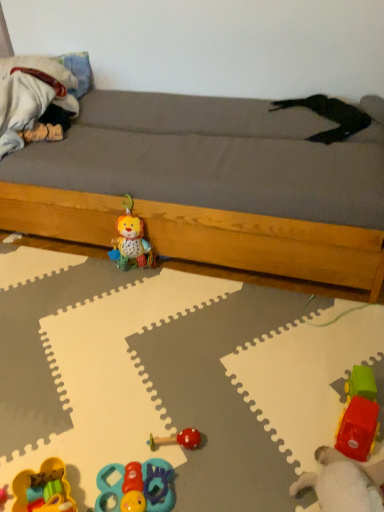
Question: Is rubberized plastic car at lower right, the second toy from the right, at the right side of plush fabric lion at center, arranged as the 5th toy when viewed from the right?

Choices:
 (A) no
 (B) yes

Answer: (B)

Question: Does rubberized plastic car at lower right, the second toy from the right, contain plush fabric lion at center, arranged as the 5th toy when viewed from the right?

Choices:
 (A) no
 (B) yes

Answer: (A)

Question: Is rubberized plastic car at lower right, the fifth toy when ordered from left to right, behind plush fabric lion at center, the 2th toy when ordered from left to right?

Choices:
 (A) no
 (B) yes

Answer: (A)

Question: Is rubberized plastic car at lower right, the fifth toy when ordered from left to right, placed right next to plush fabric lion at center, arranged as the 5th toy when viewed from the right?

Choices:
 (A) no
 (B) yes

Answer: (A)

Question: Does rubberized plastic car at lower right, the fifth toy when ordered from left to right, have a greater height compared to plush fabric lion at center, the 2th toy when ordered from left to right?

Choices:
 (A) no
 (B) yes

Answer: (A)

Question: From a real-world perspective, is rubberized plastic car at lower right, the second toy from the right, on top of plush fabric lion at center, arranged as the 5th toy when viewed from the right?

Choices:
 (A) yes
 (B) no

Answer: (B)

Question: Is wooden bed frame at center closer to camera compared to plush fabric lion at center, arranged as the 5th toy when viewed from the right?

Choices:
 (A) no
 (B) yes

Answer: (B)

Question: Is the depth of wooden bed frame at center greater than that of plush fabric lion at center, arranged as the 5th toy when viewed from the right?

Choices:
 (A) yes
 (B) no

Answer: (B)

Question: Does wooden bed frame at center have a greater width compared to plush fabric lion at center, the 2th toy when ordered from left to right?

Choices:
 (A) no
 (B) yes

Answer: (B)

Question: Does wooden bed frame at center have a lesser width compared to plush fabric lion at center, arranged as the 5th toy when viewed from the right?

Choices:
 (A) no
 (B) yes

Answer: (A)

Question: Is wooden bed frame at center smaller than plush fabric lion at center, arranged as the 5th toy when viewed from the right?

Choices:
 (A) no
 (B) yes

Answer: (A)

Question: Does wooden bed frame at center have a larger size compared to plush fabric lion at center, the 2th toy when ordered from left to right?

Choices:
 (A) yes
 (B) no

Answer: (A)

Question: From the image's perspective, would you say rubberized plastic truck at lower right, marked as the 1th toy in a right-to-left arrangement, is positioned over plush fabric lion at center, the 2th toy when ordered from left to right?

Choices:
 (A) no
 (B) yes

Answer: (A)